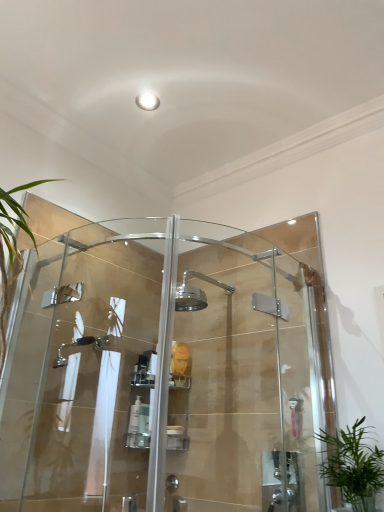
Question: From the image's perspective, is clear glass shower door at center, which is the 2th screen door from right to left, located above or below white plastic soap dish at center, the third toiletry when ordered from left to right?

Choices:
 (A) above
 (B) below

Answer: (A)

Question: Is clear glass shower door at center, which is the 2th screen door from right to left, in front of or behind white plastic soap dish at center, the third toiletry when ordered from left to right, in the image?

Choices:
 (A) behind
 (B) front

Answer: (B)

Question: Considering the real-world distances, which object is farthest from the clear glass shower door at center, which is the 2th screen door from right to left?

Choices:
 (A) green leafy plant at lower right
 (B) white plastic pump bottle at center, marked as the first toiletry in a left-to-right arrangement
 (C) clear plastic bottle at center, acting as the 2th toiletry starting from the right
 (D) clear glass shower door at center, positioned as the 2th screen door in left-to-right order
 (E) white plastic soap dish at center, the third toiletry when ordered from left to right

Answer: (A)

Question: Estimate the real-world distances between objects in this image. Which object is closer to the clear plastic bottle at center, acting as the 2th toiletry starting from the right?

Choices:
 (A) white plastic pump bottle at center, marked as the first toiletry in a left-to-right arrangement
 (B) green leafy plant at lower right
 (C) clear glass shower door at center, which is the 2th screen door from right to left
 (D) clear glass shower door at center, the 1th screen door from the right
 (E) white plastic soap dish at center, which appears as the 1th toiletry when viewed from the right

Answer: (A)